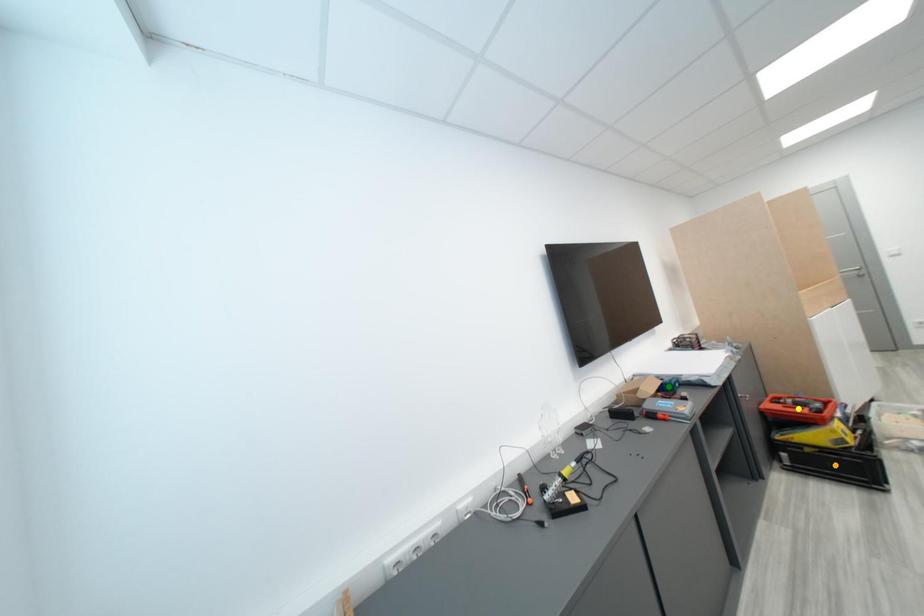
Order these from nearest to farthest:
1. green point
2. yellow point
3. orange point

orange point
yellow point
green point